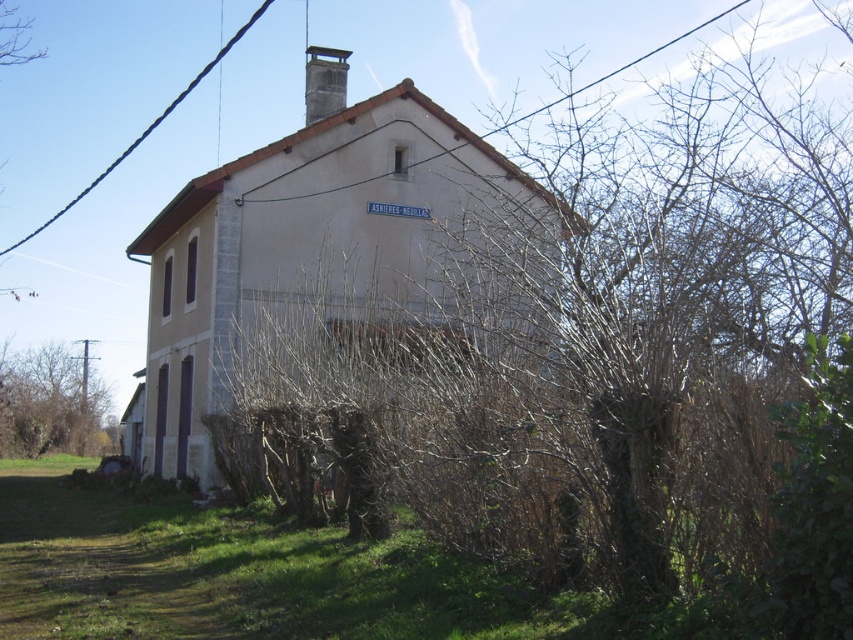
You are a bird flying over the building and see the black wire at upper center and the black wire at upper left. Which wire is closer to the ground?

The black wire at upper center has a lesser height compared to the black wire at upper left, so it is closer to the ground.

You are a landscape designer planning to plant new shrubs in the area. You have a limited budget and can only choose one between the brown dry bush at center and the brown leafless tree at left to replace. Which one would you choose to replace based on their sizes?

The brown dry bush at center is larger in size than the brown leafless tree at left, so you should choose to replace the brown leafless tree at left to save budget while maintaining similar size.